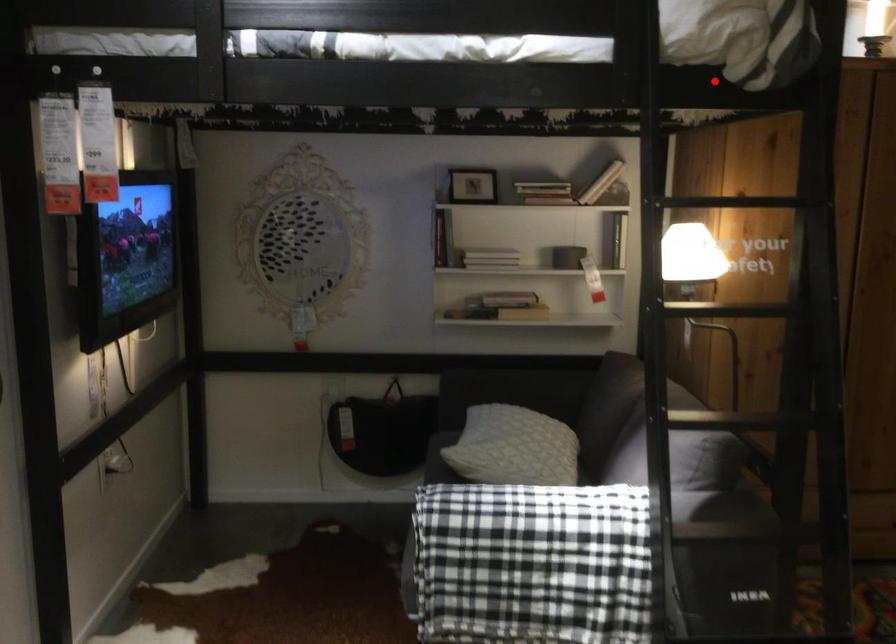
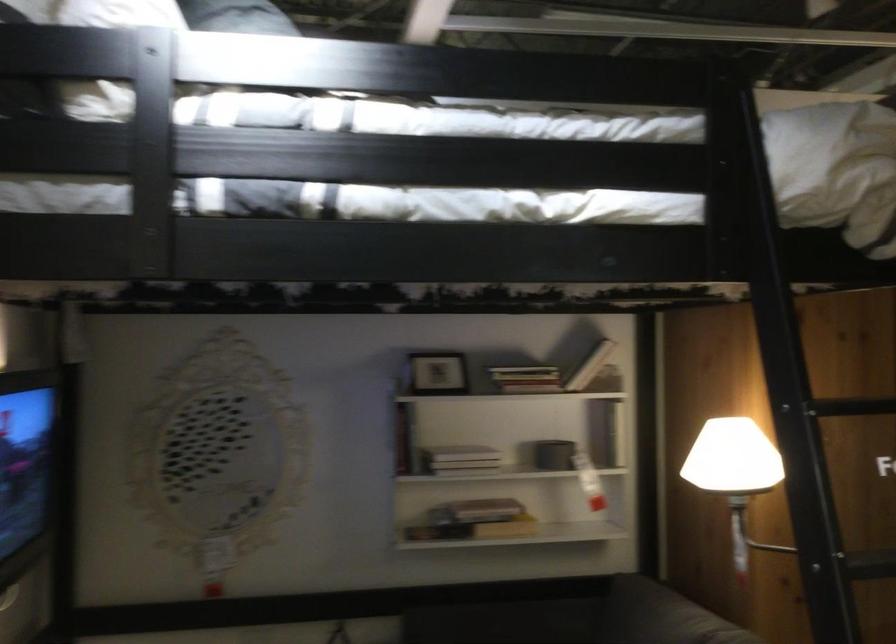
Where in the second image is the point corresponding to the highlighted location from the first image?

(831, 261)